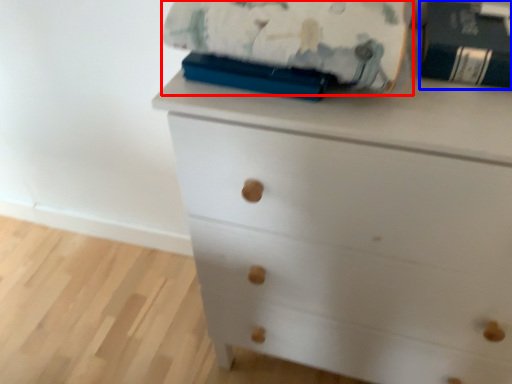
Question: Which object appears closest to the camera in this image, blanket (highlighted by a red box) or paperback book (highlighted by a blue box)?

Choices:
 (A) blanket
 (B) paperback book

Answer: (A)